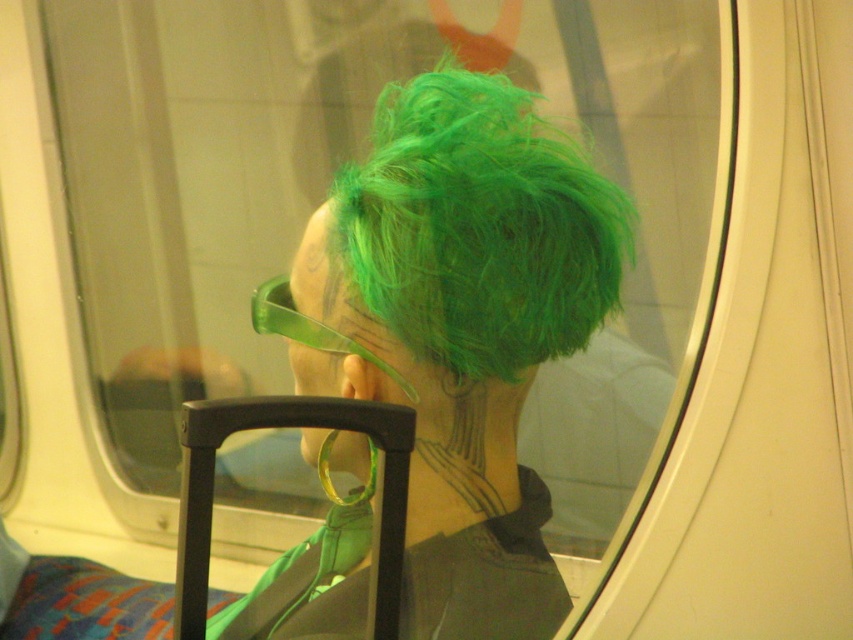
Is point (519, 216) positioned in front of point (496, 163)?

Yes, it is.

Between green matte wig at upper center and green fluffy hair at center, which one appears on the right side from the viewer's perspective?

green fluffy hair at center

Is point (517, 534) positioned behind point (418, 355)?

Yes.

Locate an element on the screen. The height and width of the screenshot is (640, 853). green matte wig at upper center is located at coordinates (457, 326).